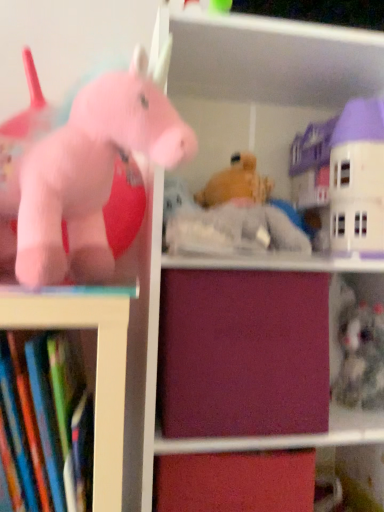
Locate an element on the screen. This screenshot has height=512, width=384. hardcover books at left is located at coordinates (46, 420).

Locate an element on the screen. This screenshot has width=384, height=512. burgundy matte drawer at center is located at coordinates (243, 353).

Locate an element on the screen. The height and width of the screenshot is (512, 384). the 2nd toy counting from the left side of the fuzzy gray stuffed animal at lower right, the first toy positioned from the back is located at coordinates (95, 176).

Consider the image. From a real-world perspective, is fuzzy gray stuffed animal at lower right, the first toy positioned from the back, physically above matte pink plush unicorn at left, which ranks as the 1th toy in left-to-right order?

Actually, fuzzy gray stuffed animal at lower right, the first toy positioned from the back, is physically below matte pink plush unicorn at left, which ranks as the 1th toy in left-to-right order, in the real world.

Is fuzzy gray stuffed animal at lower right, which is the 1th toy from right to left, with matte pink plush unicorn at left, which ranks as the 1th toy in left-to-right order?

No, fuzzy gray stuffed animal at lower right, which is the 1th toy from right to left, is not beside matte pink plush unicorn at left, which ranks as the 1th toy in left-to-right order.

Is hardcover books at left completely or partially outside of fuzzy gray stuffed animal at lower right, which ranks as the 3th toy in front-to-back order?

Yes, hardcover books at left is not within fuzzy gray stuffed animal at lower right, which ranks as the 3th toy in front-to-back order.

Between hardcover books at left and fuzzy gray stuffed animal at lower right, acting as the 3th toy starting from the left, which one has less height?

Standing shorter between the two is fuzzy gray stuffed animal at lower right, acting as the 3th toy starting from the left.

Looking at this image, from the image's perspective, is hardcover books at left beneath fuzzy gray stuffed animal at lower right, acting as the 3th toy starting from the left?

Indeed, from the image's perspective, hardcover books at left is shown beneath fuzzy gray stuffed animal at lower right, acting as the 3th toy starting from the left.

Is hardcover books at left thinner than fuzzy gray stuffed animal at lower right, which is the 1th toy from right to left?

Correct, the width of hardcover books at left is less than that of fuzzy gray stuffed animal at lower right, which is the 1th toy from right to left.

In the scene shown: Can you tell me how much burgundy matte drawer at center and pastel cream plastic house at upper right, the second toy from the back, differ in facing direction?

There is a 1.04-degree angle between the facing directions of burgundy matte drawer at center and pastel cream plastic house at upper right, the second toy from the back.

Between point (223, 412) and point (352, 106), which one is positioned behind?

The point (352, 106) is farther from the camera.

Is burgundy matte drawer at center to the left of pastel cream plastic house at upper right, the 2th toy positioned from the left, from the viewer's perspective?

Correct, you'll find burgundy matte drawer at center to the left of pastel cream plastic house at upper right, the 2th toy positioned from the left.

Is point (344, 287) behind point (89, 444)?

Yes, point (344, 287) is behind point (89, 444).

Between fuzzy gray stuffed animal at lower right, the first toy positioned from the back, and hardcover books at left, which one appears on the left side from the viewer's perspective?

hardcover books at left.

How distant is fuzzy gray stuffed animal at lower right, which ranks as the 3th toy in front-to-back order, from hardcover books at left?

fuzzy gray stuffed animal at lower right, which ranks as the 3th toy in front-to-back order, and hardcover books at left are 25.89 inches apart from each other.

Is fuzzy gray stuffed animal at lower right, the first toy positioned from the back, looking in the opposite direction of hardcover books at left?

No, fuzzy gray stuffed animal at lower right, the first toy positioned from the back,'s orientation is not away from hardcover books at left.

Considering the relative sizes of pastel cream plastic house at upper right, the 2th toy positioned from the left, and burgundy matte drawer at center in the image provided, is pastel cream plastic house at upper right, the 2th toy positioned from the left, smaller than burgundy matte drawer at center?

Yes.

From the image's perspective, is pastel cream plastic house at upper right, marked as the 2th toy in a front-to-back arrangement, positioned above or below burgundy matte drawer at center?

pastel cream plastic house at upper right, marked as the 2th toy in a front-to-back arrangement, is situated higher than burgundy matte drawer at center in the image.

Is point (371, 239) closer or farther from the camera than point (161, 291)?

Point (371, 239) appears to be farther away from the viewer than point (161, 291).

How much distance is there between pastel cream plastic house at upper right, marked as the 2th toy in a front-to-back arrangement, and burgundy matte drawer at center?

They are 11.99 inches apart.

Looking at this image, can we say matte pink plush unicorn at left, which is the first toy in front-to-back order, lies outside fuzzy gray stuffed animal at lower right, acting as the 3th toy starting from the left?

matte pink plush unicorn at left, which is the first toy in front-to-back order, lies outside fuzzy gray stuffed animal at lower right, acting as the 3th toy starting from the left,'s area.

Considering the sizes of objects matte pink plush unicorn at left, which appears as the 3th toy when viewed from the right, and fuzzy gray stuffed animal at lower right, the first toy positioned from the back, in the image provided, who is taller, matte pink plush unicorn at left, which appears as the 3th toy when viewed from the right, or fuzzy gray stuffed animal at lower right, the first toy positioned from the back,?

matte pink plush unicorn at left, which appears as the 3th toy when viewed from the right.

Which is behind, point (33, 270) or point (359, 406)?

Point (359, 406)

From a real-world perspective, is hardcover books at left above or below pastel cream plastic house at upper right, the 2th toy positioned from the left?

Clearly, from a real-world perspective, hardcover books at left is below pastel cream plastic house at upper right, the 2th toy positioned from the left.

Are hardcover books at left and pastel cream plastic house at upper right, the 2th toy positioned from the left, located far from each other?

That's not correct — hardcover books at left is a little close to pastel cream plastic house at upper right, the 2th toy positioned from the left.

From the image's perspective, who appears lower, hardcover books at left or pastel cream plastic house at upper right, marked as the 2th toy in a front-to-back arrangement?

hardcover books at left appears lower in the image.

Considering the relative sizes of hardcover books at left and pastel cream plastic house at upper right, marked as the 2th toy in a front-to-back arrangement, in the image provided, is hardcover books at left taller than pastel cream plastic house at upper right, marked as the 2th toy in a front-to-back arrangement,?

In fact, hardcover books at left may be shorter than pastel cream plastic house at upper right, marked as the 2th toy in a front-to-back arrangement.

From a real-world perspective, count 1st toys upward from the fuzzy gray stuffed animal at lower right, acting as the 3th toy starting from the left, and point to it. Please provide its 2D coordinates.

[(95, 176)]

You are a GUI agent. You are given a task and a screenshot of the screen. Output one action in this format:
    pyautogui.click(x=<x>, y=<y>)
    Task: Click on the book in front of the fuzzy gray stuffed animal at lower right, the first toy positioned from the back
    
    Given the screenshot: What is the action you would take?
    pyautogui.click(x=46, y=420)

From the image, which object appears to be nearer to fuzzy gray stuffed animal at lower right, which ranks as the 3th toy in front-to-back order, matte pink plush unicorn at left, which is the first toy in front-to-back order, or pastel cream plastic house at upper right, the second toy from the back?

Based on the image, pastel cream plastic house at upper right, the second toy from the back, appears to be nearer to fuzzy gray stuffed animal at lower right, which ranks as the 3th toy in front-to-back order.

Considering their positions, is matte pink plush unicorn at left, the 3th toy when ordered from back to front, positioned closer to fuzzy gray stuffed animal at lower right, which is the 1th toy from right to left, than hardcover books at left?

Among the two, matte pink plush unicorn at left, the 3th toy when ordered from back to front, is located nearer to fuzzy gray stuffed animal at lower right, which is the 1th toy from right to left.

Which object lies further to the anchor point hardcover books at left, fuzzy gray stuffed animal at lower right, which is the 1th toy from right to left, or pastel cream plastic house at upper right, the 2th toy positioned from the left?

pastel cream plastic house at upper right, the 2th toy positioned from the left.

When comparing their distances from fuzzy gray stuffed animal at lower right, which ranks as the 3th toy in front-to-back order, does burgundy matte drawer at center or hardcover books at left seem further?

hardcover books at left.

When comparing their distances from matte pink plush unicorn at left, which ranks as the 1th toy in left-to-right order, does burgundy matte drawer at center or pastel cream plastic house at upper right, the 2th toy positioned from the left, seem closer?

burgundy matte drawer at center lies closer to matte pink plush unicorn at left, which ranks as the 1th toy in left-to-right order, than the other object.

Looking at the image, which one is located closer to fuzzy gray stuffed animal at lower right, the first toy positioned from the back, burgundy matte drawer at center or matte pink plush unicorn at left, which appears as the 3th toy when viewed from the right?

Among the two, burgundy matte drawer at center is located nearer to fuzzy gray stuffed animal at lower right, the first toy positioned from the back.

Estimate the real-world distances between objects in this image. Which object is closer to matte pink plush unicorn at left, which appears as the 3th toy when viewed from the right, pastel cream plastic house at upper right, the 2th toy positioned from the left, or fuzzy gray stuffed animal at lower right, which ranks as the 3th toy in front-to-back order?

pastel cream plastic house at upper right, the 2th toy positioned from the left.

From the picture: When comparing their distances from hardcover books at left, does burgundy matte drawer at center or matte pink plush unicorn at left, which appears as the 3th toy when viewed from the right, seem closer?

matte pink plush unicorn at left, which appears as the 3th toy when viewed from the right, is positioned closer to the anchor hardcover books at left.

I want to click on toy between hardcover books at left and pastel cream plastic house at upper right, the 2th toy in the right-to-left sequence, in the horizontal direction, so coord(95,176).

The height and width of the screenshot is (512, 384). I want to click on drawer located between matte pink plush unicorn at left, the 3th toy when ordered from back to front, and fuzzy gray stuffed animal at lower right, which is the 1th toy from right to left, in the left-right direction, so click(x=243, y=353).

Locate an element on the screen. This screenshot has width=384, height=512. drawer between hardcover books at left and fuzzy gray stuffed animal at lower right, which ranks as the 3th toy in front-to-back order, in the horizontal direction is located at coordinates (243, 353).

At what (x,y) coordinates should I click in order to perform the action: click on drawer that lies between pastel cream plastic house at upper right, the 2th toy in the right-to-left sequence, and fuzzy gray stuffed animal at lower right, acting as the 3th toy starting from the left, from top to bottom. Please return your answer as a coordinate pair (x, y). Looking at the image, I should click on (243, 353).